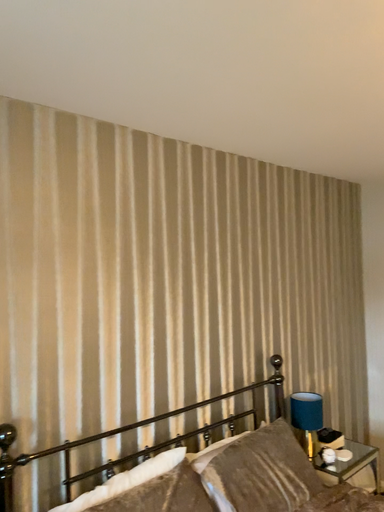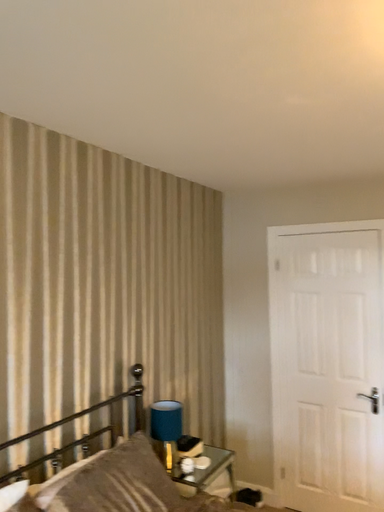
Question: Which way did the camera rotate in the video?

Choices:
 (A) rotated right
 (B) rotated left

Answer: (A)